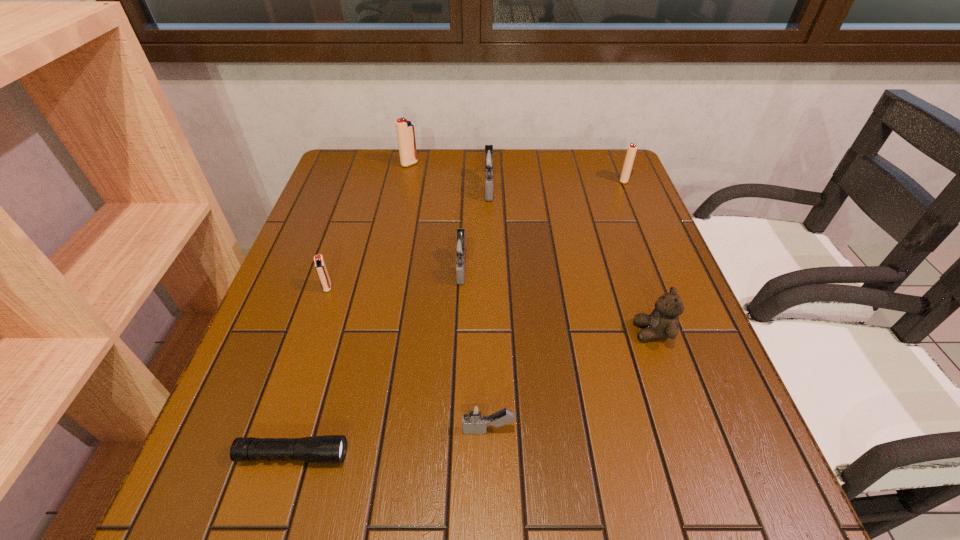
At what (x,y) coordinates should I click in order to perform the action: click on blank space at the left edge. Please return your answer as a coordinate pair (x, y). The width and height of the screenshot is (960, 540). Looking at the image, I should click on [x=308, y=252].

Image resolution: width=960 pixels, height=540 pixels. In the image, there is a desktop. What are the coordinates of `vacant space at the right edge` in the screenshot? It's located at (619, 218).

Identify the location of vacant space at the far left corner of the desktop. (382, 174).

The image size is (960, 540). What are the coordinates of `vacant space at the far right corner` in the screenshot? It's located at (609, 164).

Find the location of a particular element. The height and width of the screenshot is (540, 960). free space between the second red igniter from left to right and the second nearest gray igniter is located at coordinates click(x=436, y=216).

You are a GUI agent. You are given a task and a screenshot of the screen. Output one action in this format:
    pyautogui.click(x=<x>, y=<y>)
    Task: Click on the free spot between the nearest gray igniter and the leftmost igniter
    
    Given the screenshot: What is the action you would take?
    pyautogui.click(x=408, y=359)

Find the location of a particular element. empty space between the second biggest gray igniter and the farthest gray igniter is located at coordinates (475, 228).

Locate an element on the screen. blank region between the second smallest gray igniter and the leftmost igniter is located at coordinates (395, 278).

At what (x,y) coordinates should I click in order to perform the action: click on free space between the smallest gray igniter and the rightmost red igniter. Please return your answer as a coordinate pair (x, y). Looking at the image, I should click on (556, 306).

Find the location of `empty space that is in between the shortest object and the biggest red igniter`. empty space that is in between the shortest object and the biggest red igniter is located at coordinates (351, 309).